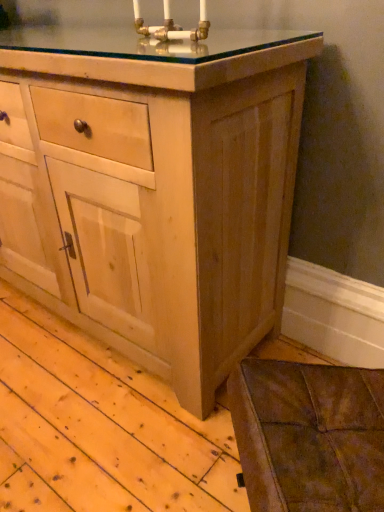
In order to face natural wood cabinet at center, should I rotate leftwards or rightwards?

Turn left approximately 16.439 degrees to face it.

This screenshot has height=512, width=384. Describe the element at coordinates (154, 191) in the screenshot. I see `natural wood cabinet at center` at that location.

Locate an element on the screen. The height and width of the screenshot is (512, 384). natural wood cabinet at center is located at coordinates (154, 191).

The height and width of the screenshot is (512, 384). What do you see at coordinates (172, 25) in the screenshot?
I see `gold brass candle holder at upper center` at bounding box center [172, 25].

Measure the distance between point (136, 15) and camera.

The depth of point (136, 15) is 3.48 feet.

Measure the distance between gold brass candle holder at upper center and camera.

87.15 centimeters.

Identify the location of gold brass candle holder at upper center. (172, 25).

I want to click on natural wood cabinet at center, so click(x=154, y=191).

Considering the relative positions of natural wood cabinet at center and gold brass candle holder at upper center in the image provided, is natural wood cabinet at center to the left or to the right of gold brass candle holder at upper center?

From the image, it's evident that natural wood cabinet at center is to the left of gold brass candle holder at upper center.

Does natural wood cabinet at center come in front of gold brass candle holder at upper center?

Yes, it is in front of gold brass candle holder at upper center.

Considering the points (125, 212) and (173, 34), which point is in front, point (125, 212) or point (173, 34)?

Positioned in front is point (173, 34).

From the image's perspective, would you say natural wood cabinet at center is positioned over gold brass candle holder at upper center?

Incorrect, from the image's perspective, natural wood cabinet at center is lower than gold brass candle holder at upper center.

From a real-world perspective, is natural wood cabinet at center physically above gold brass candle holder at upper center?

Actually, natural wood cabinet at center is physically below gold brass candle holder at upper center in the real world.

Which of these two, natural wood cabinet at center or gold brass candle holder at upper center, is wider?

natural wood cabinet at center is wider.

Can you confirm if natural wood cabinet at center is taller than gold brass candle holder at upper center?

Yes.

Does natural wood cabinet at center have a smaller size compared to gold brass candle holder at upper center?

No, natural wood cabinet at center is not smaller than gold brass candle holder at upper center.

Is natural wood cabinet at center situated inside gold brass candle holder at upper center or outside?

natural wood cabinet at center is not inside gold brass candle holder at upper center, it's outside.

Consider the image. Is natural wood cabinet at center far away from gold brass candle holder at upper center?

They are positioned close to each other.

Could you tell me if natural wood cabinet at center is facing gold brass candle holder at upper center?

No, natural wood cabinet at center is not aimed at gold brass candle holder at upper center.

What's the angular difference between natural wood cabinet at center and gold brass candle holder at upper center's facing directions?

The angular difference between natural wood cabinet at center and gold brass candle holder at upper center is 5.5e-05 degrees.

In the image, there is a natural wood cabinet at center. Identify the location of candle holder above it (from the image's perspective). (172, 25).

Between gold brass candle holder at upper center and natural wood cabinet at center, which one appears on the left side from the viewer's perspective?

From the viewer's perspective, natural wood cabinet at center appears more on the left side.

Is the position of gold brass candle holder at upper center more distant than that of natural wood cabinet at center?

Yes, gold brass candle holder at upper center is behind natural wood cabinet at center.

Which is behind, point (181, 37) or point (301, 72)?

Positioned behind is point (301, 72).

From the image's perspective, does gold brass candle holder at upper center appear higher than natural wood cabinet at center?

Yes.

In the scene shown: From a real-world perspective, is gold brass candle holder at upper center under natural wood cabinet at center?

Incorrect, from a real-world perspective, gold brass candle holder at upper center is higher than natural wood cabinet at center.

Consider the image. Does gold brass candle holder at upper center have a greater width compared to natural wood cabinet at center?

In fact, gold brass candle holder at upper center might be narrower than natural wood cabinet at center.

Who is taller, gold brass candle holder at upper center or natural wood cabinet at center?

Standing taller between the two is natural wood cabinet at center.

Can you confirm if gold brass candle holder at upper center is bigger than natural wood cabinet at center?

No.

Is gold brass candle holder at upper center positioned beyond the bounds of natural wood cabinet at center?

That's correct, gold brass candle holder at upper center is outside of natural wood cabinet at center.

Would you say gold brass candle holder at upper center is a long distance from natural wood cabinet at center?

gold brass candle holder at upper center is actually quite close to natural wood cabinet at center.

Looking at this image, is gold brass candle holder at upper center looking in the opposite direction of natural wood cabinet at center?

No.

How different are the orientations of gold brass candle holder at upper center and natural wood cabinet at center in degrees?

5.5e-05 degrees.

Locate an element on the screen. This screenshot has width=384, height=512. chest of drawers located on the left of gold brass candle holder at upper center is located at coordinates (154, 191).

This screenshot has width=384, height=512. Find the location of `candle holder behind the natural wood cabinet at center`. candle holder behind the natural wood cabinet at center is located at coordinates (172, 25).

Find the location of a particular element. the chest of drawers directly beneath the gold brass candle holder at upper center (from a real-world perspective) is located at coordinates (154, 191).